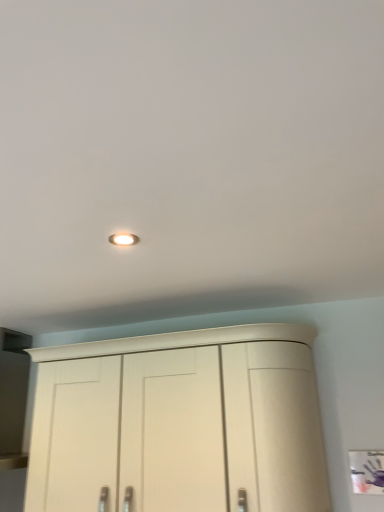
Question: Based on their positions, is matte white cupboard at lower center located to the left or right of white glossy light fixture at upper center?

Choices:
 (A) right
 (B) left

Answer: (A)

Question: From the image's perspective, relative to white glossy light fixture at upper center, is matte white cupboard at lower center above or below?

Choices:
 (A) below
 (B) above

Answer: (A)

Question: Is matte white cupboard at lower center wider or thinner than white glossy light fixture at upper center?

Choices:
 (A) thin
 (B) wide

Answer: (B)

Question: Is white glossy light fixture at upper center inside or outside of matte white cupboard at lower center?

Choices:
 (A) inside
 (B) outside

Answer: (B)

Question: Considering their positions, is white glossy light fixture at upper center located in front of or behind matte white cupboard at lower center?

Choices:
 (A) front
 (B) behind

Answer: (A)

Question: From the image's perspective, relative to matte white cupboard at lower center, is white glossy light fixture at upper center above or below?

Choices:
 (A) below
 (B) above

Answer: (B)

Question: In the image, is white glossy light fixture at upper center on the left side or the right side of matte white cupboard at lower center?

Choices:
 (A) left
 (B) right

Answer: (A)